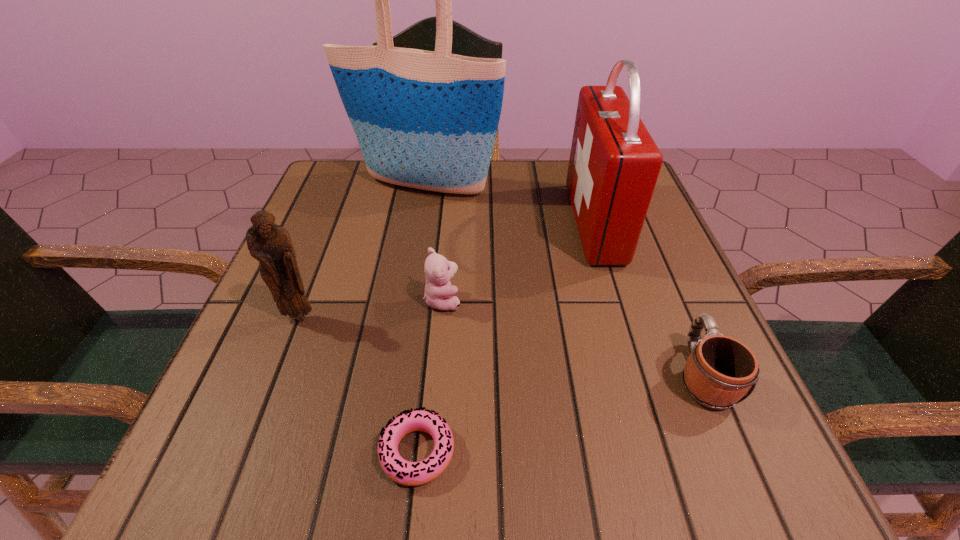
At what (x,y) coordinates should I click in order to perform the action: click on the tallest object. Please return your answer as a coordinate pair (x, y). The height and width of the screenshot is (540, 960). Looking at the image, I should click on (428, 120).

Image resolution: width=960 pixels, height=540 pixels. I want to click on the first-aid kit, so click(614, 164).

Where is `the fifth object from left to right`? Image resolution: width=960 pixels, height=540 pixels. the fifth object from left to right is located at coordinates (614, 164).

At what (x,y) coordinates should I click in order to perform the action: click on the third tallest object. Please return your answer as a coordinate pair (x, y). Looking at the image, I should click on (270, 244).

The width and height of the screenshot is (960, 540). What are the coordinates of `teddy bear` in the screenshot? It's located at (439, 294).

Where is `mug`? mug is located at coordinates (719, 372).

At what (x,y) coordinates should I click in order to perform the action: click on the second shortest object. Please return your answer as a coordinate pair (x, y). Looking at the image, I should click on (719, 372).

Find the location of a particular element. The height and width of the screenshot is (540, 960). the shortest object is located at coordinates (404, 472).

Where is `doughnut`? doughnut is located at coordinates (404, 472).

You are a GUI agent. You are given a task and a screenshot of the screen. Output one action in this format:
    pyautogui.click(x=<x>, y=<y>)
    Task: Click on the free space located on the right of the tote bag
    This screenshot has height=540, width=960.
    Given the screenshot: What is the action you would take?
    pyautogui.click(x=622, y=185)